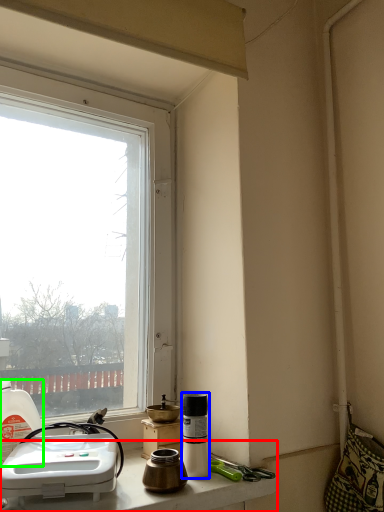
Question: Which is nearer to the counter top (highlighted by a red box)? bottle (highlighted by a blue box) or bottle (highlighted by a green box).

Choices:
 (A) bottle
 (B) bottle

Answer: (A)